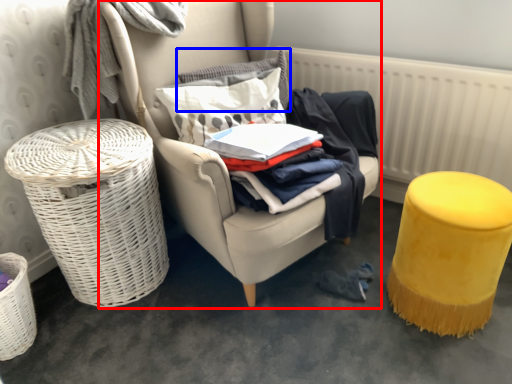
Question: Which object appears farthest to the camera in this image, chair (highlighted by a red box) or pillow (highlighted by a blue box)?

Choices:
 (A) chair
 (B) pillow

Answer: (B)